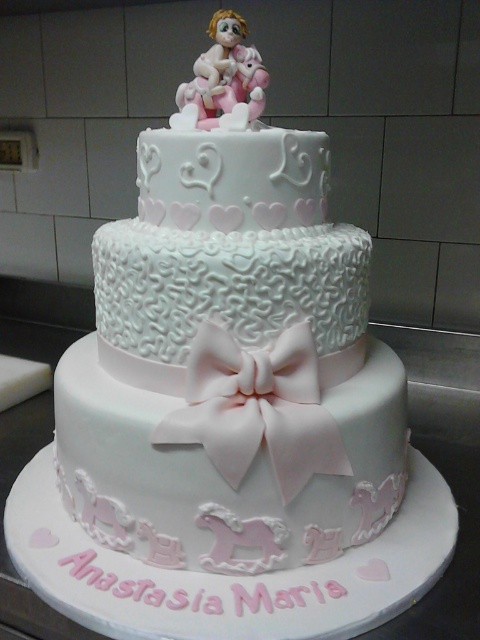
You are standing in front of the cake and want to place a small decoration on the closest point between point (289, 429) and point (226, 19). Which point should you choose?

Point (289, 429) is closer to the viewer than point (226, 19), so you should choose point (289, 429) to place the decoration.

You are a guest at the baby shower and want to take a photo of the cake. You notice the pink satin bow at center and the pink porcelain figurine at top. Which one appears larger in your photo?

The pink satin bow at center appears larger in the photo because it is closer to the viewer than the pink porcelain figurine at top.